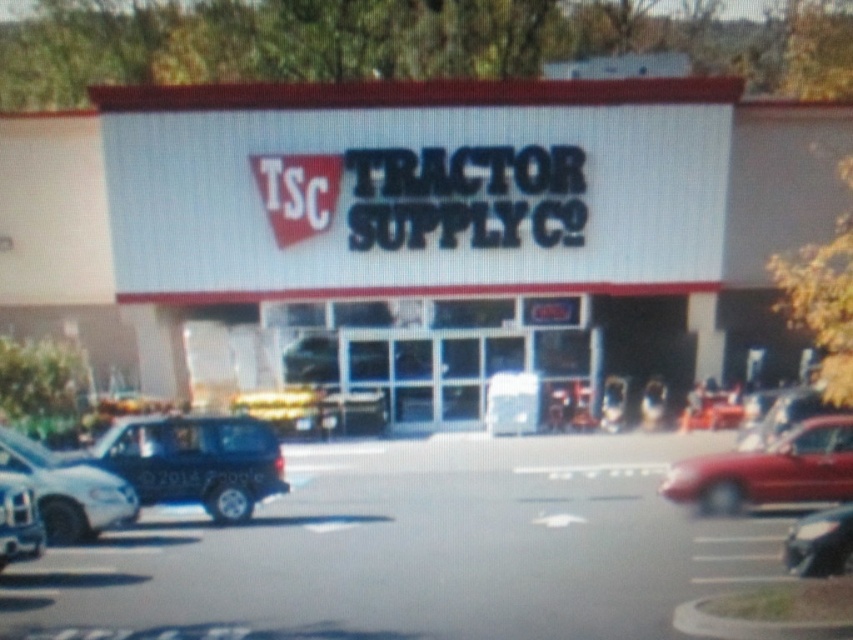
Is white matte truck at lower left closer to camera compared to matte black suv at lower left?

No.

Which is more to the left, white matte truck at lower left or matte black suv at lower left?

From the viewer's perspective, white matte truck at lower left appears more on the left side.

This screenshot has height=640, width=853. I want to click on white matte truck at lower left, so click(x=67, y=490).

Identify the location of white matte truck at lower left. (67, 490).

Who is taller, shiny red car at right or white matte truck at lower left?

Standing taller between the two is shiny red car at right.

Is shiny red car at right taller than white matte truck at lower left?

Correct, shiny red car at right is much taller as white matte truck at lower left.

The height and width of the screenshot is (640, 853). I want to click on shiny red car at right, so click(769, 470).

In order to click on shiny red car at right in this screenshot , I will do `click(769, 470)`.

From the picture: Who is higher up, white matte building at center or shiny black sedan at lower right?

white matte building at center

Who is more forward, (782,346) or (793,552)?

Point (793,552) is more forward.

Identify the location of white matte building at center. This screenshot has width=853, height=640. (415, 228).